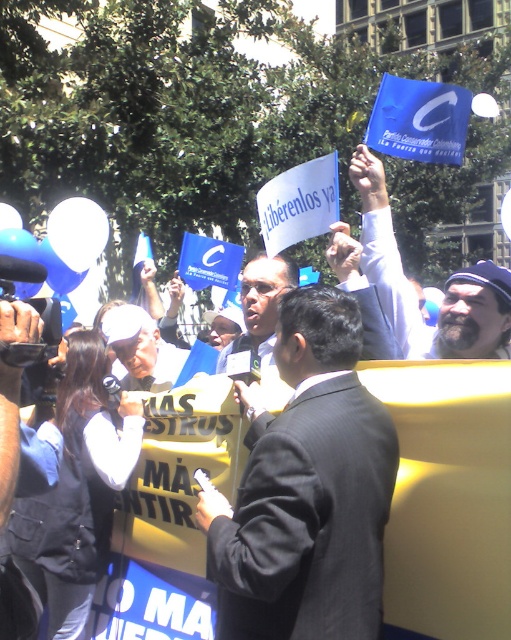
You are a photographer standing at the edge of the crowd, and you want to capture a photo of both the dark gray suit at center and the black fabric vest at center in the same frame. Given that your camera has a minimum focus distance of 1 meter, will you be able to take the photo without moving closer?

The distance between the dark gray suit at center and the black fabric vest at center is 1.02 meters. Since the minimum focus distance is 1 meter, the photographer can capture both in the same frame as the distance between them is just over the required minimum.

From the picture: You are a photographer trying to capture a clear shot of the black fabric vest at center and the blue fabric flag at upper right. Based on their sizes in the scene, which object would appear larger in your photo?

Result: The black fabric vest at center appears larger in the photo because it is taller than the blue fabric flag at upper right.

Where is the dark gray suit at center located in the image?

The dark gray suit at center is located at the 2D coordinates point (307, 490).